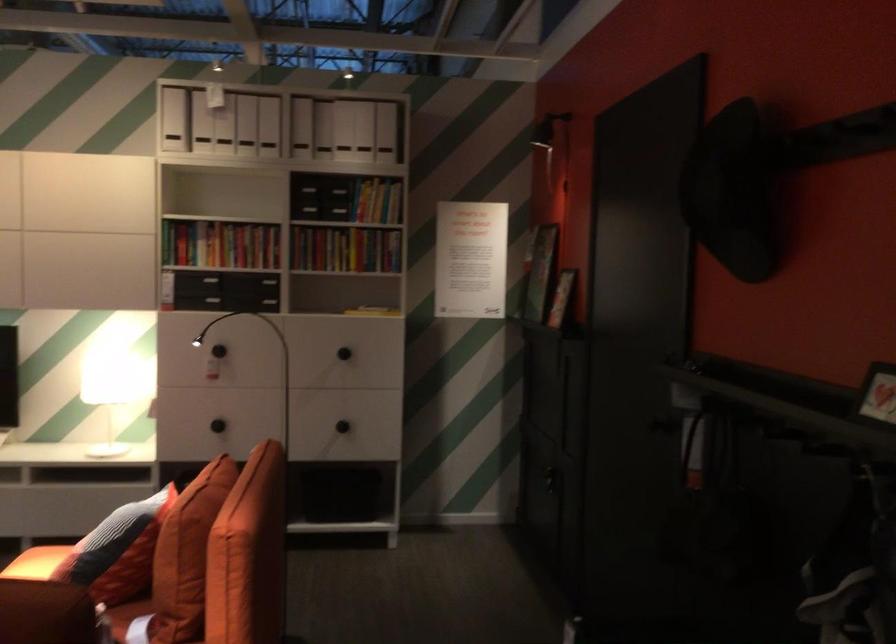
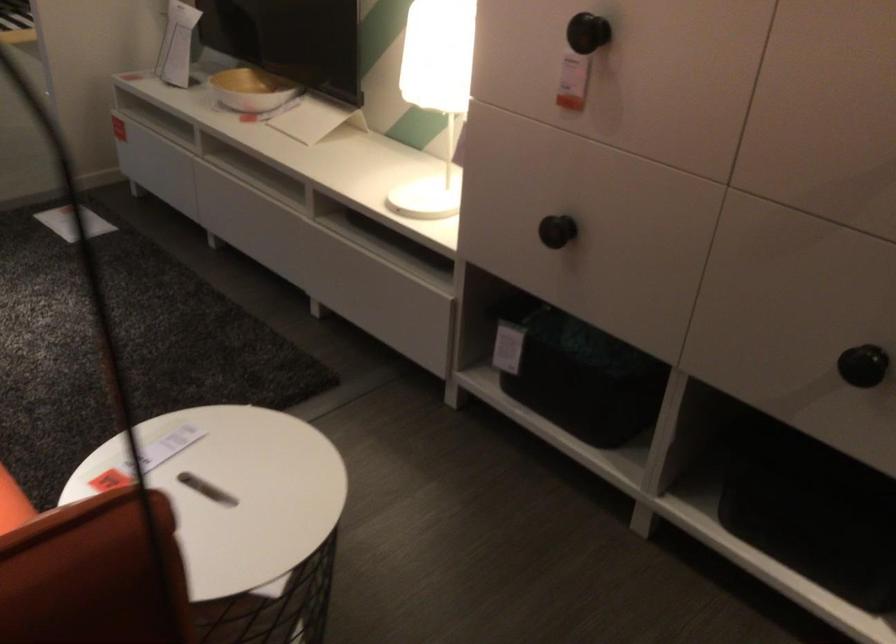
Locate, in the second image, the point that corresponds to pixel 219 420 in the first image.

(556, 231)